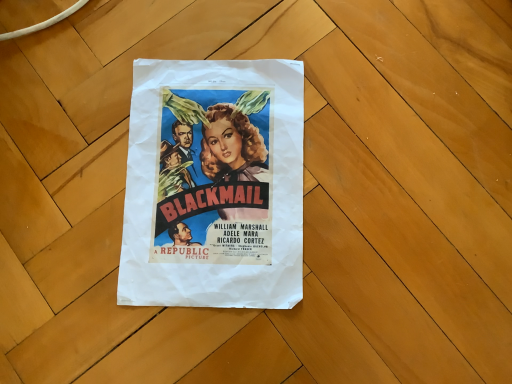
Where is `blank space situated above matte paper poster at center (from a real-world perspective)`? blank space situated above matte paper poster at center (from a real-world perspective) is located at coordinates (216, 178).